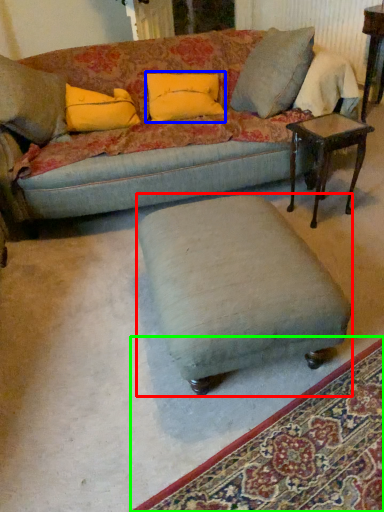
Question: Which is farther away from stool (highlighted by a red box)? pillow (highlighted by a blue box) or mat (highlighted by a green box)?

Choices:
 (A) pillow
 (B) mat

Answer: (A)